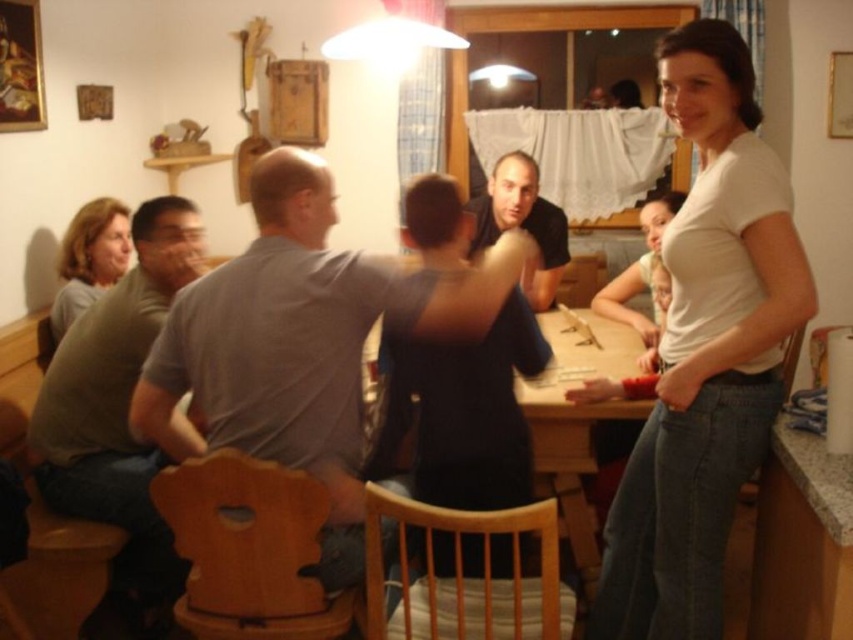
Is point (329, 342) closer to viewer compared to point (142, 202)?

Yes, point (329, 342) is closer to viewer.

Between point (288, 180) and point (157, 577), which one is positioned behind?

Point (157, 577)

Where is `gray matte shirt at center`? The width and height of the screenshot is (853, 640). gray matte shirt at center is located at coordinates (303, 340).

Looking at this image, between gray cotton shirt at left and black matte shirt at center, which one is positioned higher?

Positioned higher is black matte shirt at center.

Who is positioned more to the right, gray cotton shirt at left or black matte shirt at center?

From the viewer's perspective, black matte shirt at center appears more on the right side.

I want to click on gray cotton shirt at left, so click(119, 416).

I want to click on gray cotton shirt at left, so click(119, 416).

Is gray cotton shirt at left smaller than matte gray shirt at left?

No, gray cotton shirt at left is not smaller than matte gray shirt at left.

Between gray cotton shirt at left and matte gray shirt at left, which one appears on the left side from the viewer's perspective?

matte gray shirt at left

Is point (90, 420) more distant than point (112, 273)?

That is False.

At what (x,y) coordinates should I click in order to perform the action: click on gray cotton shirt at left. Please return your answer as a coordinate pair (x, y). The width and height of the screenshot is (853, 640). Looking at the image, I should click on (119, 416).